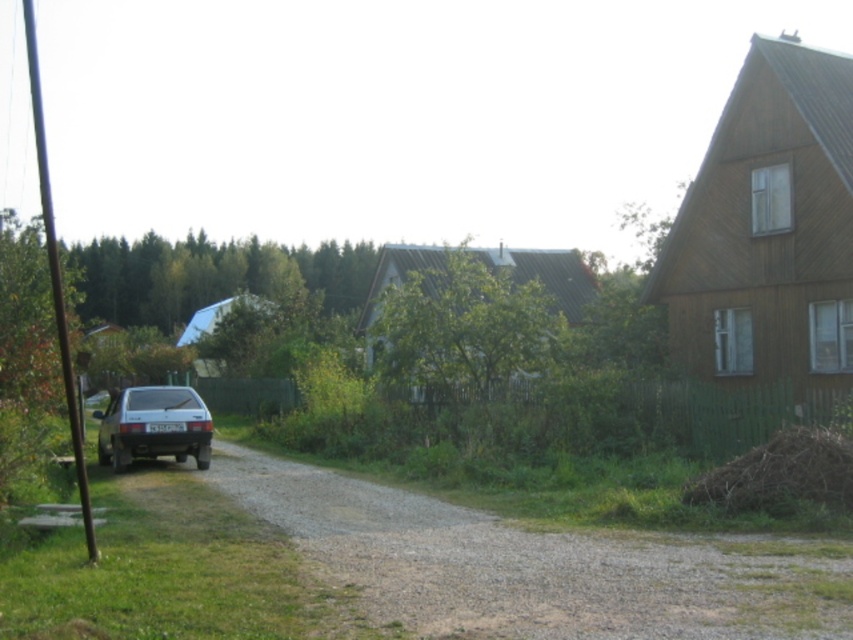
Does point (848, 566) lie in front of point (770, 483)?

Yes, point (848, 566) is closer to viewer.

Locate an element on the screen. This screenshot has width=853, height=640. gray gravel driveway at lower left is located at coordinates (532, 564).

The height and width of the screenshot is (640, 853). I want to click on gray gravel driveway at lower left, so click(532, 564).

Is gray gravel driveway at lower left smaller than satin silver car at left?

Yes, gray gravel driveway at lower left is smaller than satin silver car at left.

This screenshot has width=853, height=640. Describe the element at coordinates (532, 564) in the screenshot. I see `gray gravel driveway at lower left` at that location.

Is point (473, 632) positioned before point (207, 429)?

Yes.

Where is `gray gravel driveway at lower left`? The width and height of the screenshot is (853, 640). gray gravel driveway at lower left is located at coordinates (532, 564).

Who is shorter, brown dry hay at right or satin silver car at left?

Standing shorter between the two is brown dry hay at right.

Is brown dry hay at right wider than satin silver car at left?

No.

Is point (802, 500) farther from camera compared to point (151, 410)?

No, (802, 500) is closer to viewer.

Locate an element on the screen. brown dry hay at right is located at coordinates (781, 474).